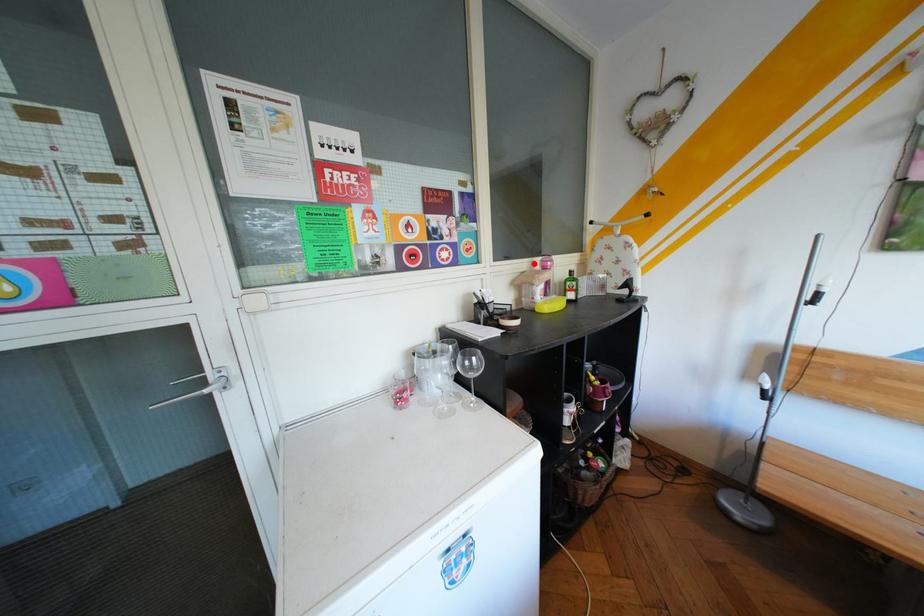
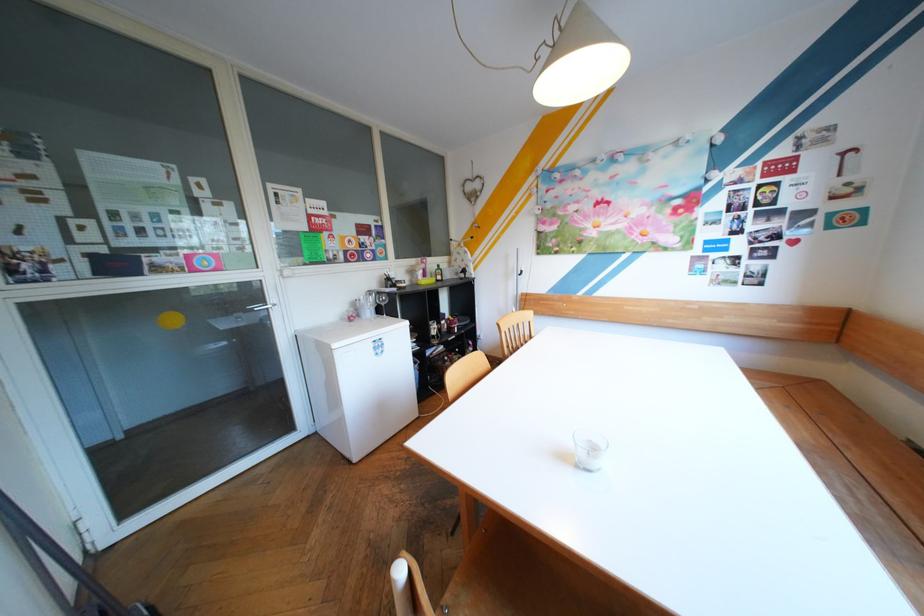
Locate, in the second image, the point that corresponds to the highlighted location in the first image.

(426, 261)